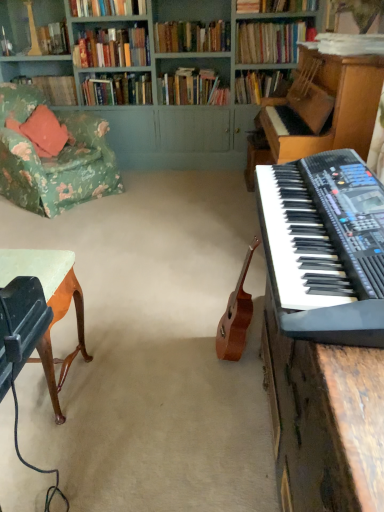
Question: From a real-world perspective, does hardcover books at upper center, which is the 8th book from back to front, sit lower than hardcover books at center, the 8th book when ordered from front to back?

Choices:
 (A) no
 (B) yes

Answer: (A)

Question: Is hardcover books at upper center, acting as the third book starting from the front, aimed at hardcover books at center, which appears as the 3th book when viewed from the back?

Choices:
 (A) no
 (B) yes

Answer: (A)

Question: Is hardcover books at center, the 8th book when ordered from front to back, inside hardcover books at upper center, acting as the third book starting from the front?

Choices:
 (A) no
 (B) yes

Answer: (A)

Question: Does hardcover books at upper center, which is the 8th book from back to front, lie behind hardcover books at center, the 8th book when ordered from front to back?

Choices:
 (A) yes
 (B) no

Answer: (B)

Question: From a real-world perspective, is hardcover books at upper center, which is the 8th book from back to front, positioned over hardcover books at center, the 8th book when ordered from front to back, based on gravity?

Choices:
 (A) yes
 (B) no

Answer: (A)

Question: Is green painted wood bookcase at upper center situated inside black plastic keyboard at right or outside?

Choices:
 (A) inside
 (B) outside

Answer: (B)

Question: Is point (109, 114) positioned closer to the camera than point (294, 102)?

Choices:
 (A) farther
 (B) closer

Answer: (A)

Question: In the image, is green painted wood bookcase at upper center on the left side or the right side of black plastic keyboard at right?

Choices:
 (A) right
 (B) left

Answer: (B)

Question: In terms of size, does green painted wood bookcase at upper center appear bigger or smaller than black plastic keyboard at right?

Choices:
 (A) big
 (B) small

Answer: (A)

Question: In the image, is hardcover book at upper center, the 4th book positioned from the back, on the left side or the right side of hardcover books at upper center, the sixth book from the back?

Choices:
 (A) left
 (B) right

Answer: (B)

Question: From the image's perspective, is hardcover book at upper center, the 4th book positioned from the back, above or below hardcover books at upper center, the sixth book from the back?

Choices:
 (A) above
 (B) below

Answer: (B)

Question: Considering the positions of point click(x=274, y=92) and point click(x=155, y=37), is point click(x=274, y=92) closer or farther from the camera than point click(x=155, y=37)?

Choices:
 (A) farther
 (B) closer

Answer: (A)

Question: Considering the positions of hardcover book at upper center, the 4th book positioned from the back, and hardcover books at upper center, the sixth book from the back, in the image, is hardcover book at upper center, the 4th book positioned from the back, bigger or smaller than hardcover books at upper center, the sixth book from the back,?

Choices:
 (A) big
 (B) small

Answer: (A)

Question: Would you say white paper at upper right, the 1th book viewed from the front, is inside or outside black plastic keyboard at right?

Choices:
 (A) inside
 (B) outside

Answer: (B)

Question: Considering their positions, is white paper at upper right, the 10th book positioned from the back, located in front of or behind black plastic keyboard at right?

Choices:
 (A) behind
 (B) front

Answer: (A)